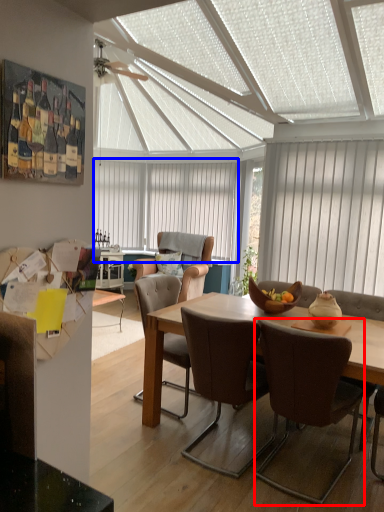
Question: Which of the following is the closest to the observer, chair (highlighted by a red box) or window (highlighted by a blue box)?

Choices:
 (A) chair
 (B) window

Answer: (A)